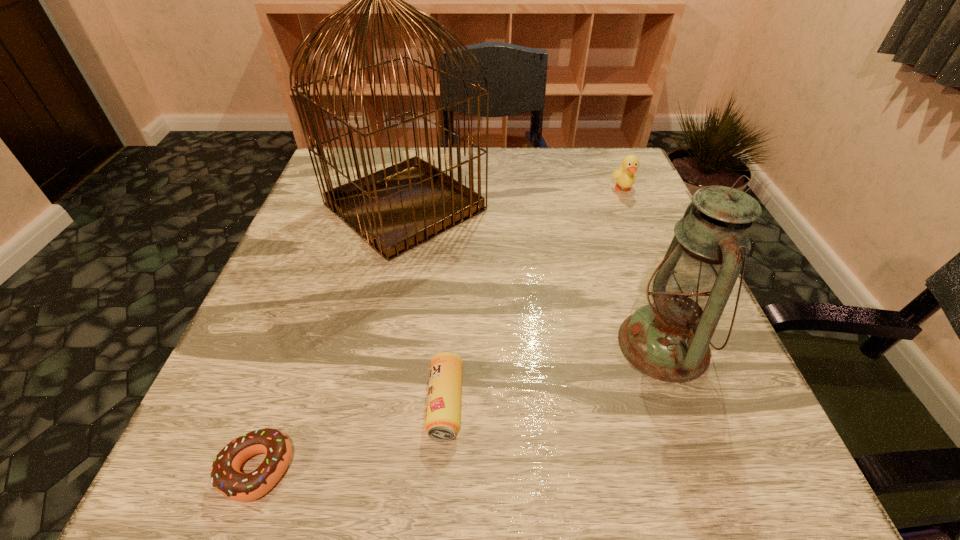
This screenshot has width=960, height=540. What are the coordinates of `the tallest object` in the screenshot? It's located at (395, 209).

Find the location of a particular element. This screenshot has height=540, width=960. oil lamp is located at coordinates click(668, 339).

This screenshot has height=540, width=960. I want to click on duckling, so click(625, 176).

You are a GUI agent. You are given a task and a screenshot of the screen. Output one action in this format:
    pyautogui.click(x=<x>, y=<y>)
    Task: Click on the second shortest object
    Image resolution: width=960 pixels, height=540 pixels.
    Given the screenshot: What is the action you would take?
    pyautogui.click(x=443, y=410)

I want to click on the shortest object, so click(x=226, y=477).

Locate an element on the screen. The image size is (960, 540). free region located 0.280m on the right of the birdcage is located at coordinates [610, 207].

Locate an element on the screen. The height and width of the screenshot is (540, 960). free region located on the back of the fourth shortest object is located at coordinates (631, 256).

This screenshot has width=960, height=540. What are the coordinates of `free space located 0.280m on the front-facing side of the duckling` in the screenshot? It's located at (662, 282).

Find the location of a particular element. The width and height of the screenshot is (960, 540). free point located on the right of the second shortest object is located at coordinates (530, 403).

Identify the location of free space located on the back of the doughnut. This screenshot has width=960, height=540. (311, 316).